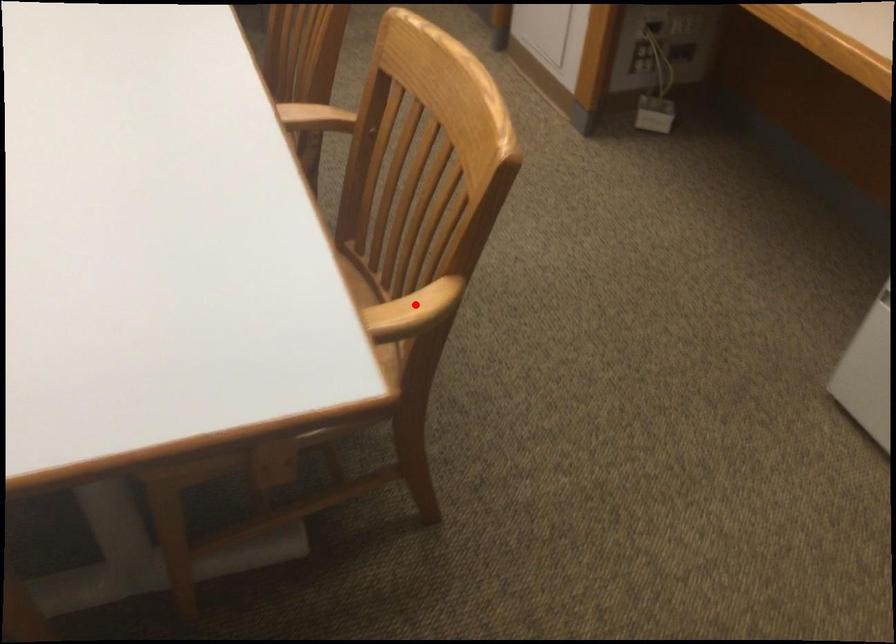
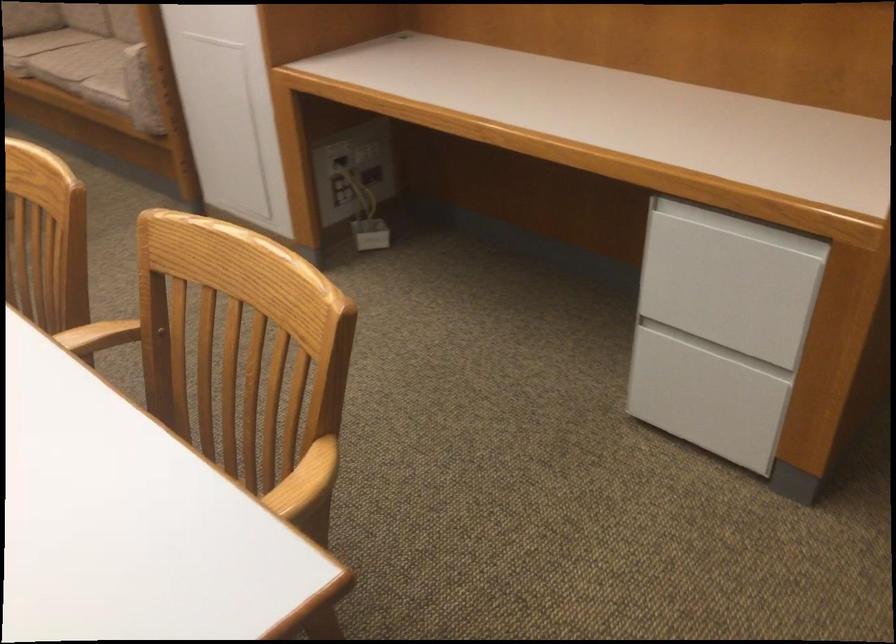
In the second image, find the point that corresponds to the highlighted location in the first image.

(304, 482)